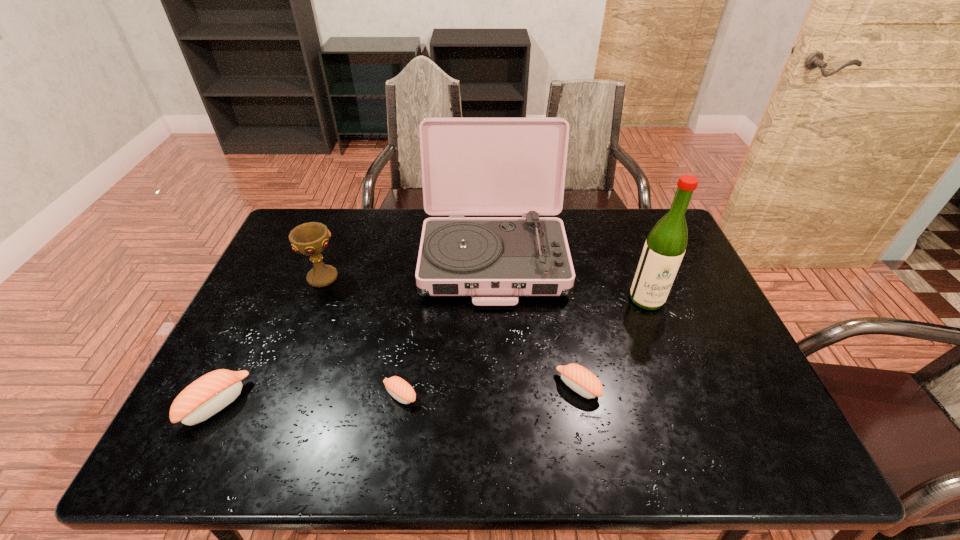
Please point a spot on the right to add another sushi. Please provide its 2D coordinates. Your answer should be formatted as a tuple, i.e. [(x, y)], where the tuple contains the x and y coordinates of a point satisfying the conditions above.

[(751, 379)]